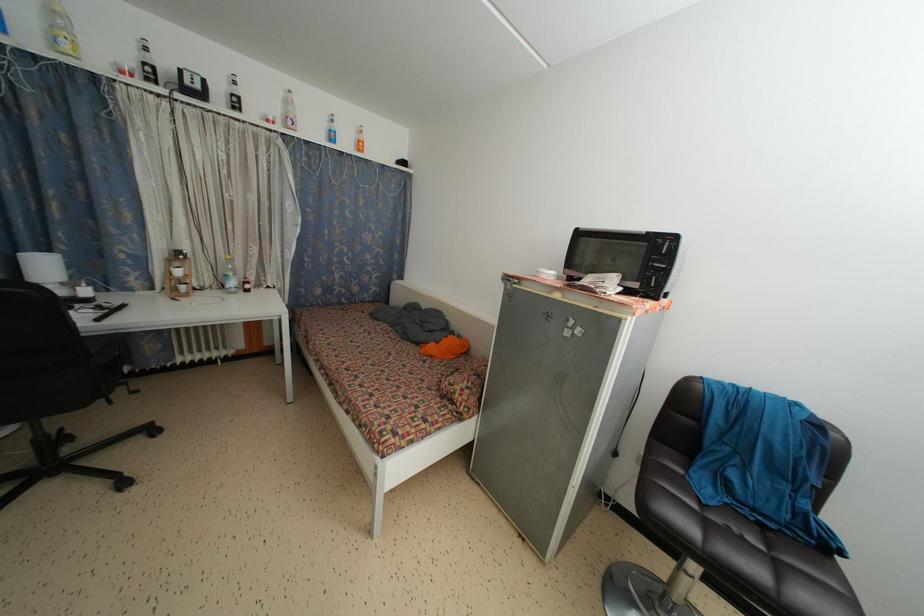
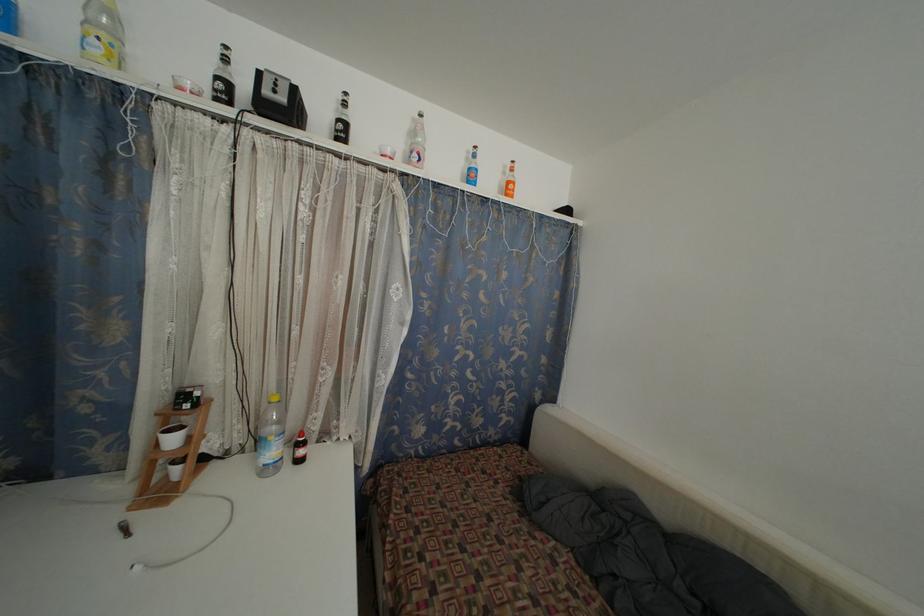
Find the pixel in the second image that matches point 251,292 in the first image.

(305, 458)